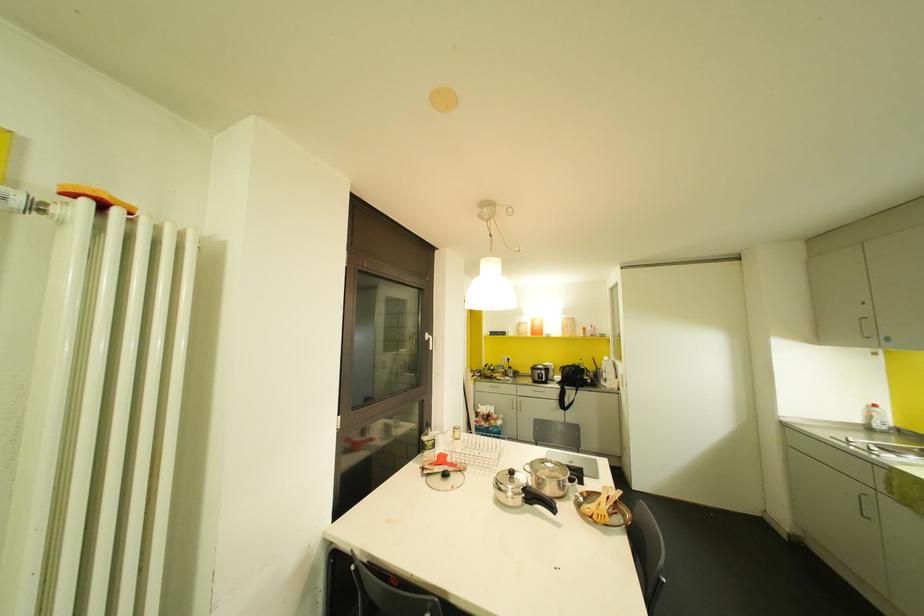
Locate an element on the screen. This screenshot has height=616, width=924. black pot handle is located at coordinates (544, 504).